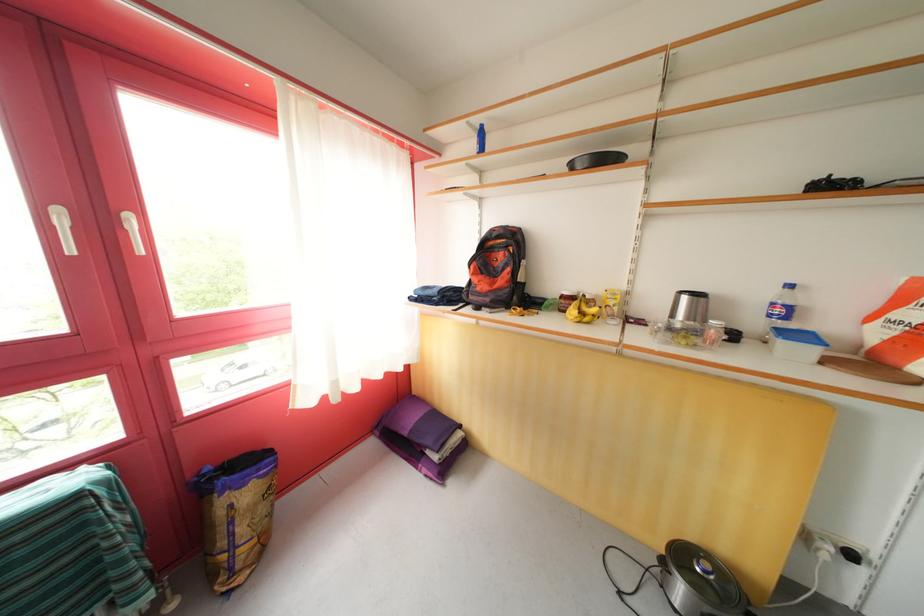
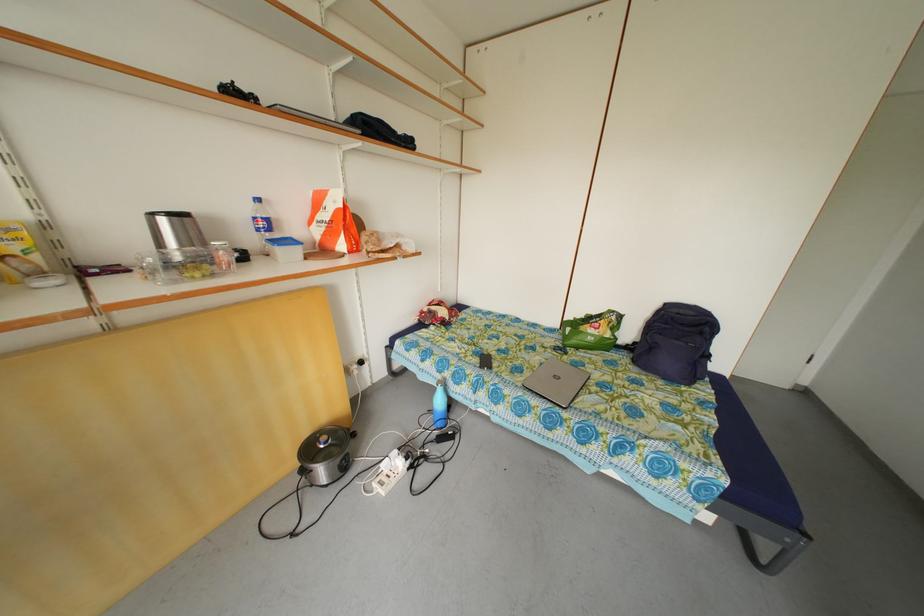
The point at (697, 541) is marked in the first image. Where is the corresponding point in the second image?

(313, 440)